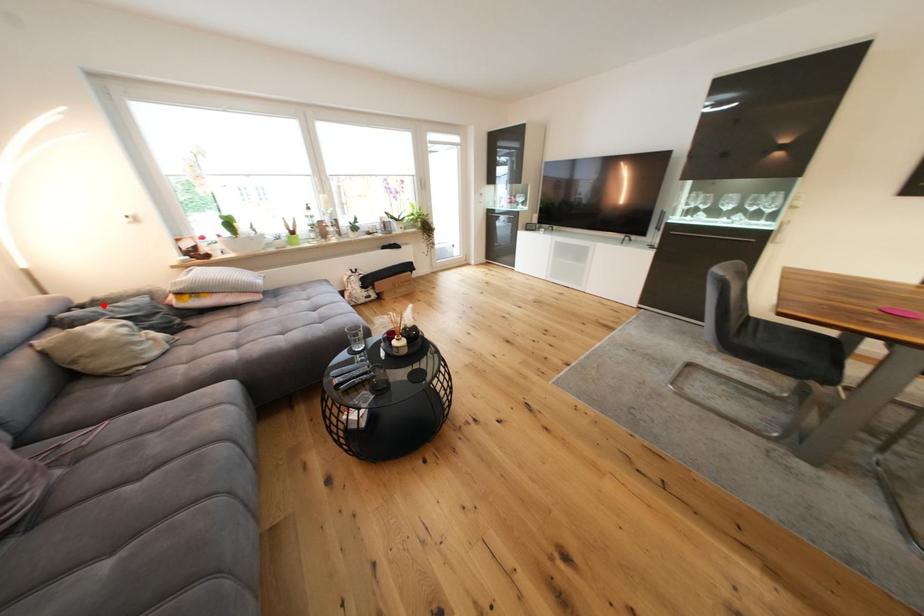
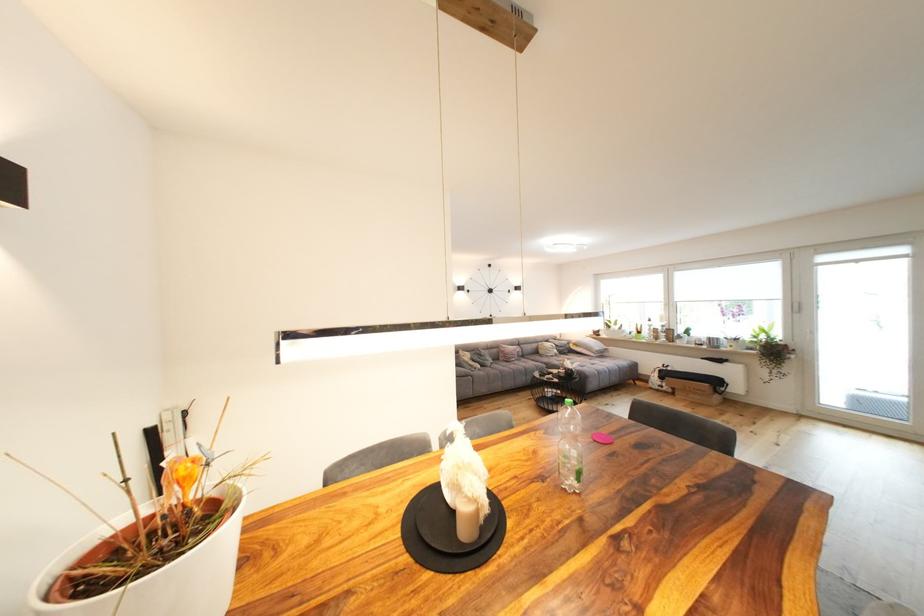
Where in the second image is the point corresponding to the highlighted location from the first image?

(566, 342)